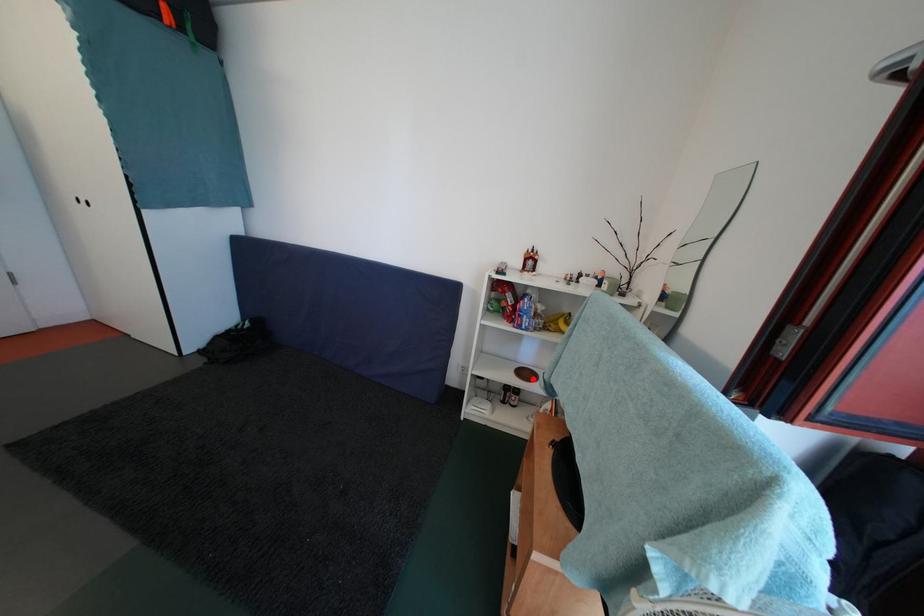
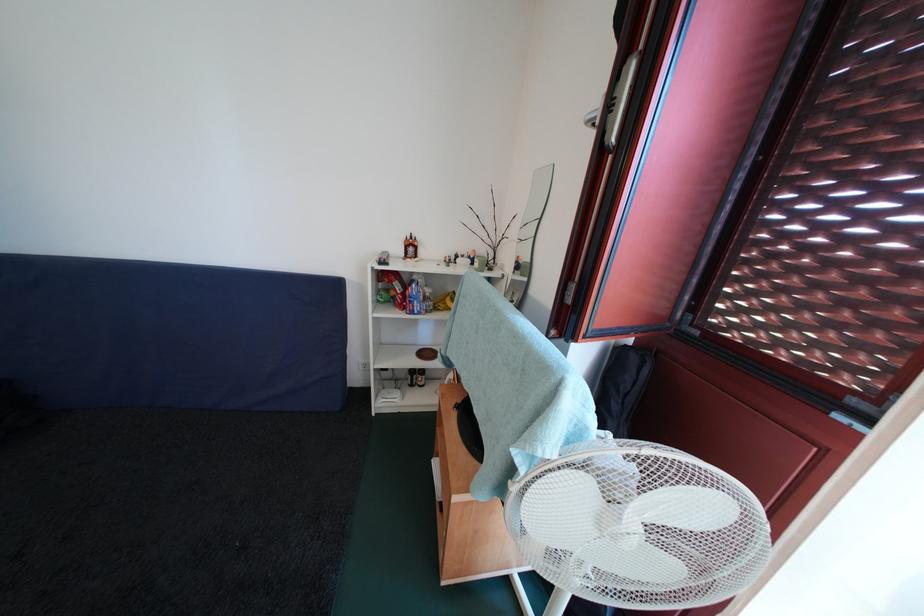
Find the pixel in the second image that matches the highlighted location in the first image.

(433, 359)